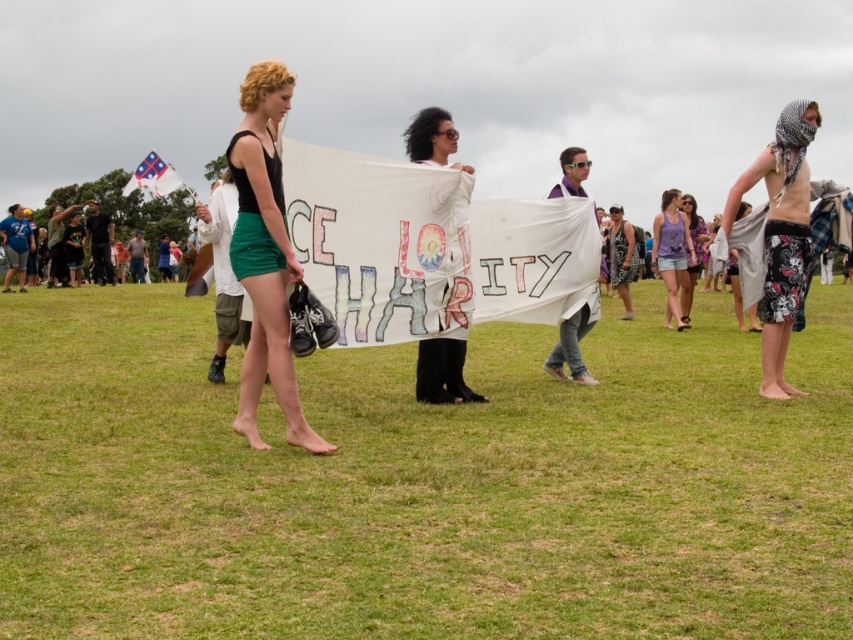
You are a photographer at the event and want to capture the white fabric banner at center and the purple fabric at center in a single shot. Which fabric will appear closer to the camera in the photo?

The white fabric banner at center will appear closer to the camera because it is in front of the purple fabric at center.